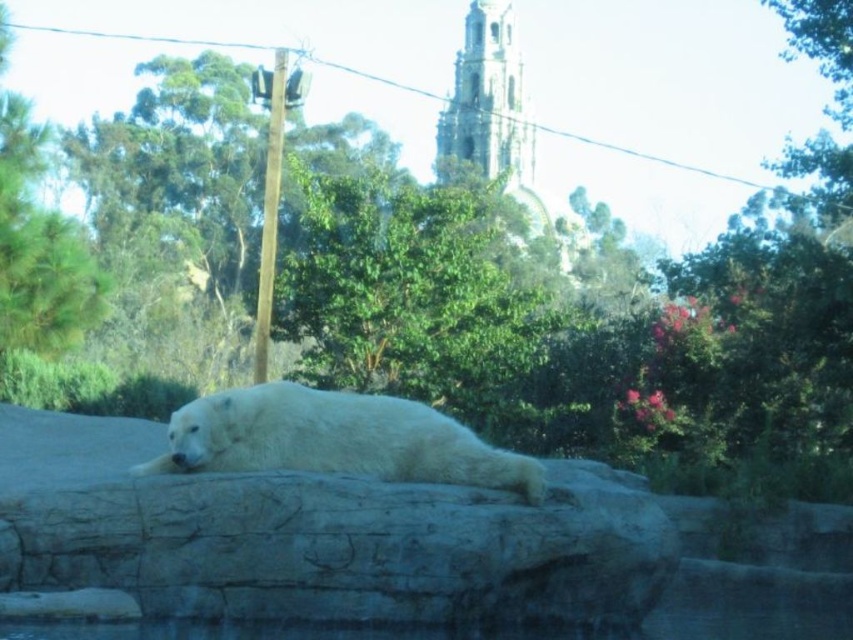
Is point (325, 605) closer to camera compared to point (479, 470)?

Yes, it is.

The width and height of the screenshot is (853, 640). I want to click on white smooth rock at center, so click(x=318, y=536).